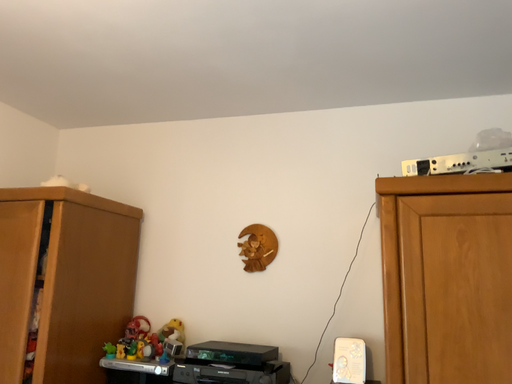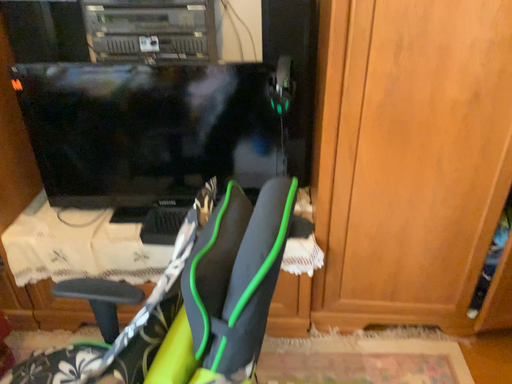
Question: How did the camera likely rotate when shooting the video?

Choices:
 (A) rotated right
 (B) rotated left

Answer: (A)